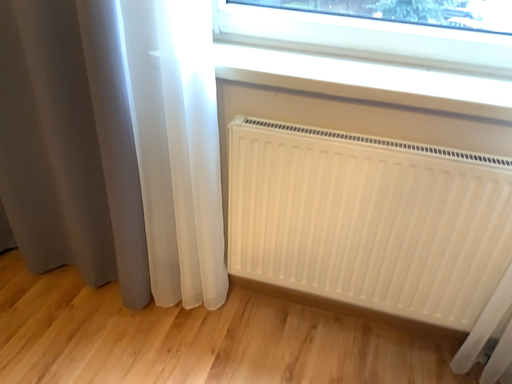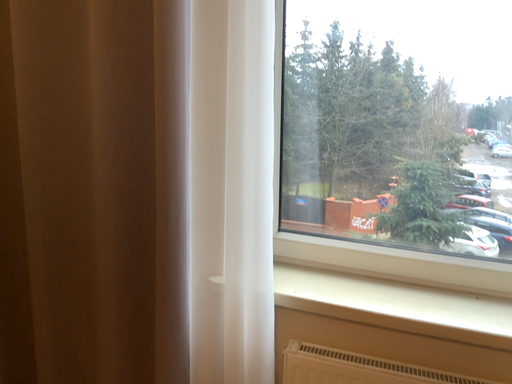
Question: How did the camera likely rotate when shooting the video?

Choices:
 (A) rotated downward
 (B) rotated upward

Answer: (B)